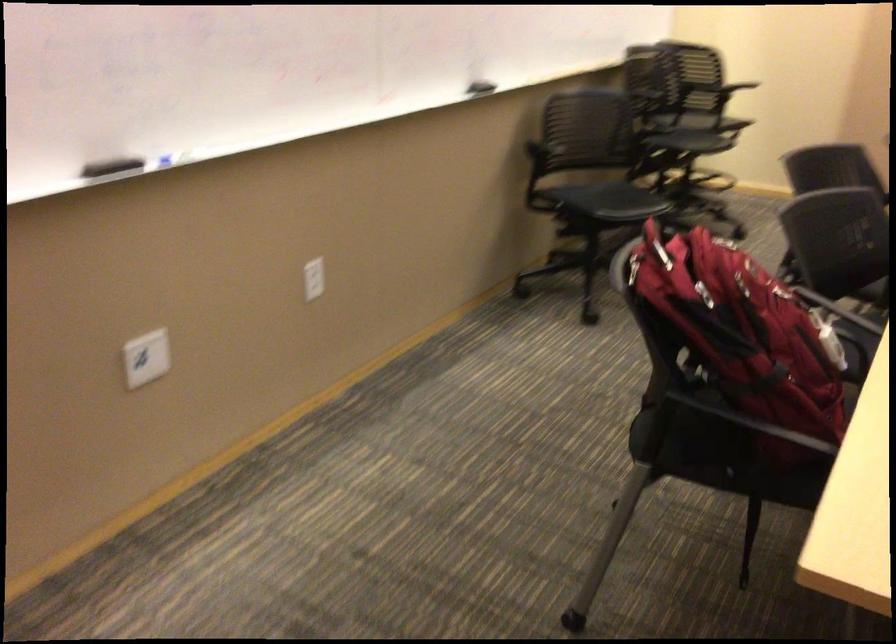
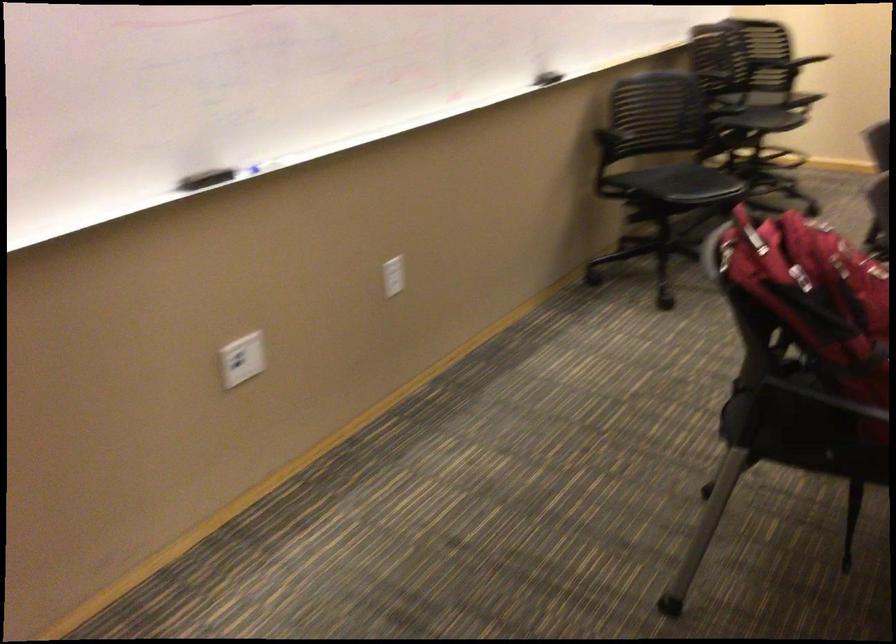
The point at (x=314, y=279) is marked in the first image. Where is the corresponding point in the second image?

(392, 276)